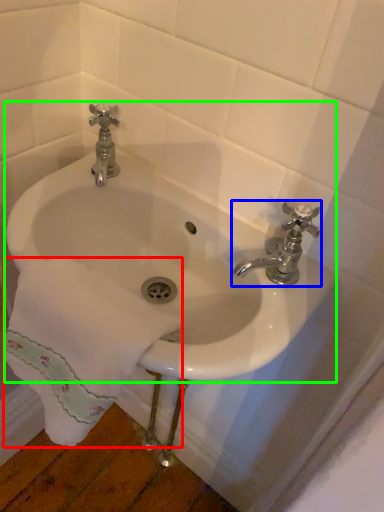
Question: Which is farther away from bath towel (highlighted by a red box)? tap (highlighted by a blue box) or sink (highlighted by a green box)?

Choices:
 (A) tap
 (B) sink

Answer: (A)